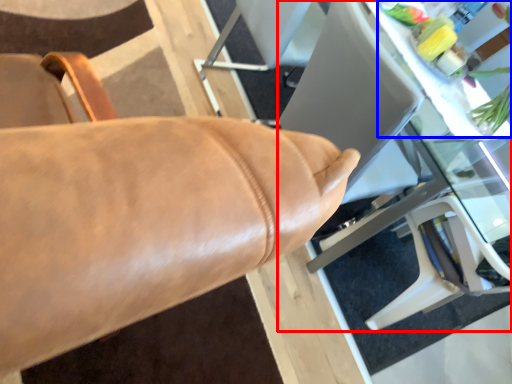
Question: Which object is closer to the camera taking this photo, table (highlighted by a red box) or floral arrangement (highlighted by a blue box)?

Choices:
 (A) table
 (B) floral arrangement

Answer: (A)